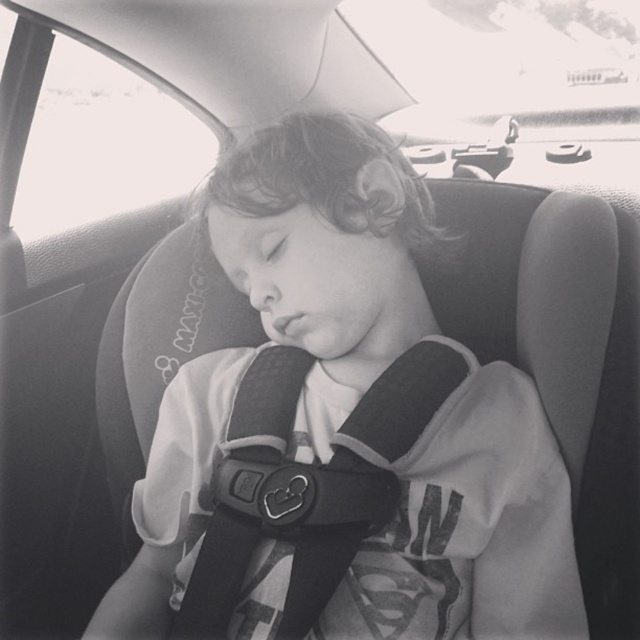
You are a photographer taking a closeup shot of the smooth fabric shirt at center. You want to ensure the camera is exactly 30 inches away. Is the current distance sufficient?

The smooth fabric shirt at center is 29.89 inches from camera, so the current distance is sufficient as it is just under 30 inches.

You are a safety inspector checking the car seat installation. The harness buckle is at point (202, 500). According to safety standards, the buckle must be at least 36 inches away from the viewer. Is the current distance compliant?

The point (202, 500) is 34.12 inches away from the viewer, which is less than the required 36 inches. Therefore, the current distance does not comply with safety standards.